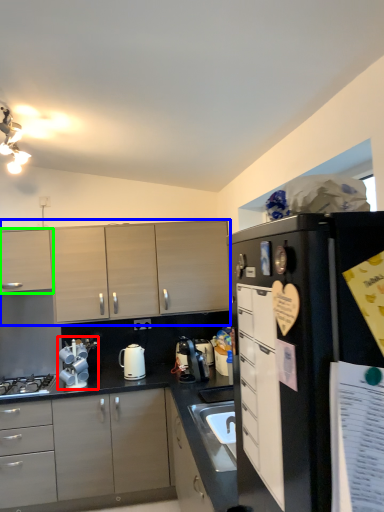
Question: Which object is positioned closest to appliance (highlighted by a red box)? Select from cabinetry (highlighted by a blue box) and cabinetry (highlighted by a green box).

Choices:
 (A) cabinetry
 (B) cabinetry

Answer: (A)